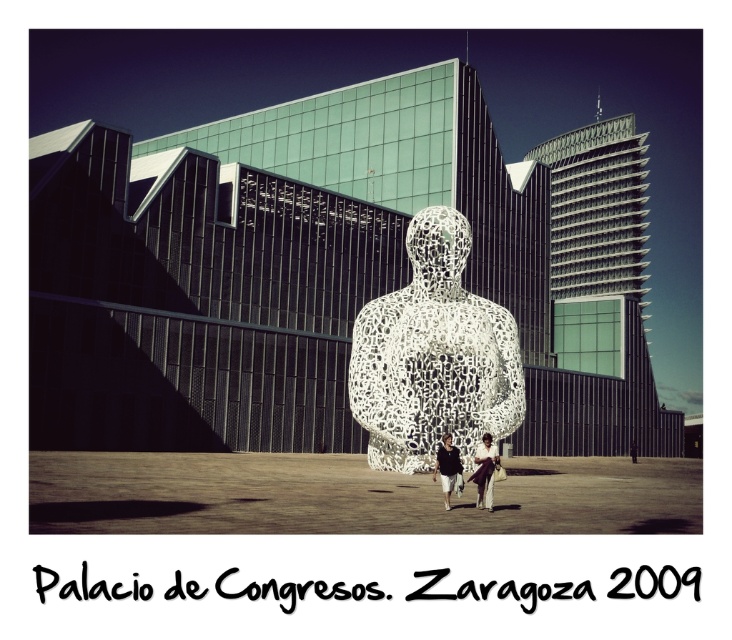
Question: Can you confirm if white textured sculpture at center is bigger than dark gray fabric pants at lower center?

Choices:
 (A) yes
 (B) no

Answer: (A)

Question: Does white porous sculpture at center have a smaller size compared to white textured sculpture at center?

Choices:
 (A) no
 (B) yes

Answer: (A)

Question: Does white porous sculpture at center have a larger size compared to white textured sculpture at center?

Choices:
 (A) yes
 (B) no

Answer: (A)

Question: Estimate the real-world distances between objects in this image. Which object is farther from the white porous sculpture at center?

Choices:
 (A) white textured sculpture at center
 (B) dark gray fabric pants at lower center

Answer: (A)

Question: Which object is the closest to the white porous sculpture at center?

Choices:
 (A) dark gray fabric pants at lower center
 (B) white textured sculpture at center

Answer: (A)

Question: Which of these objects is positioned farthest from the white porous sculpture at center?

Choices:
 (A) white textured sculpture at center
 (B) dark gray fabric pants at lower center

Answer: (A)